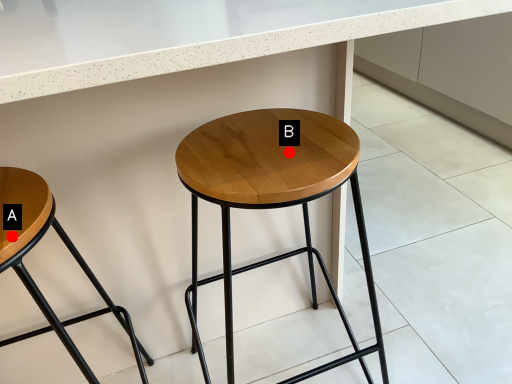
Question: Two points are circled on the image, labeled by A and B beside each circle. Which point is further to the camera?

Choices:
 (A) A is further
 (B) B is further

Answer: (B)